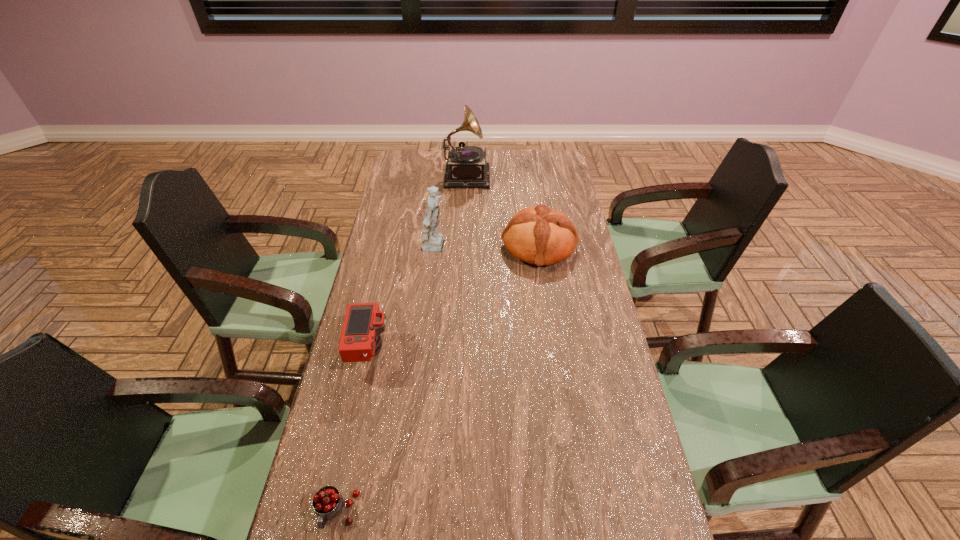
The height and width of the screenshot is (540, 960). What are the coordinates of `free region located 0.190m on the back of the camera` in the screenshot? It's located at (384, 286).

Image resolution: width=960 pixels, height=540 pixels. I want to click on object that is positioned at the far edge, so click(466, 167).

Where is `camera that is at the left edge`? camera that is at the left edge is located at coordinates (360, 340).

Find the location of a particular element. This screenshot has height=540, width=960. cherry that is at the left edge is located at coordinates (327, 502).

You are a GUI agent. You are given a task and a screenshot of the screen. Output one action in this format:
    pyautogui.click(x=<x>, y=<y>)
    Task: Click on the object present at the right edge
    This screenshot has height=540, width=960.
    Given the screenshot: What is the action you would take?
    [x=538, y=235]

This screenshot has height=540, width=960. In the image, there is a desktop. Identify the location of vacant space at the far edge. (500, 160).

What are the coordinates of `free space at the left edge` in the screenshot? It's located at (365, 455).

At what (x,y) coordinates should I click in order to perform the action: click on free location at the far left corner. Please return your answer as a coordinate pair (x, y). Looking at the image, I should click on (401, 164).

Find the location of a particular element. The height and width of the screenshot is (540, 960). vacant space at the far right corner is located at coordinates (x=562, y=156).

Locate an element on the screen. The height and width of the screenshot is (540, 960). free spot between the shortest object and the rightmost object is located at coordinates (438, 379).